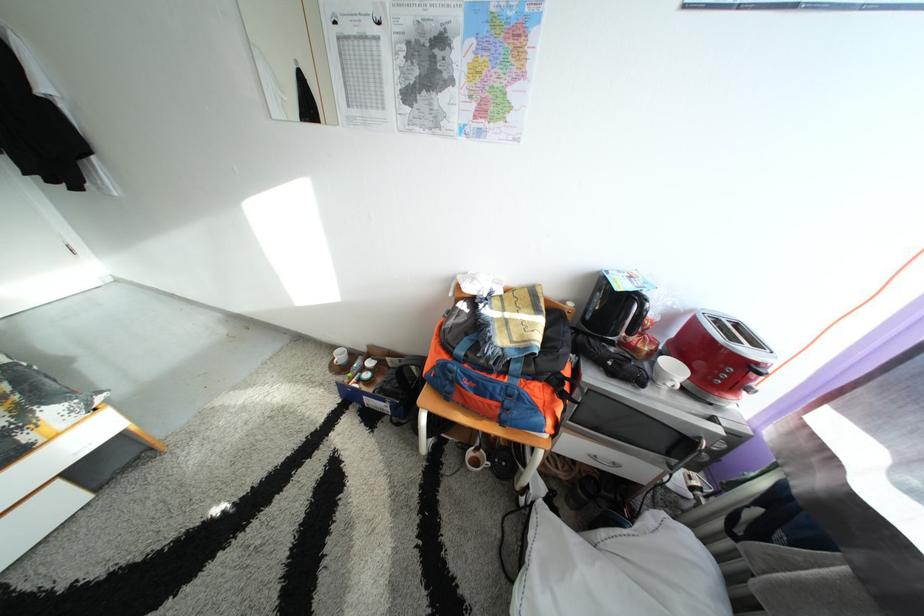
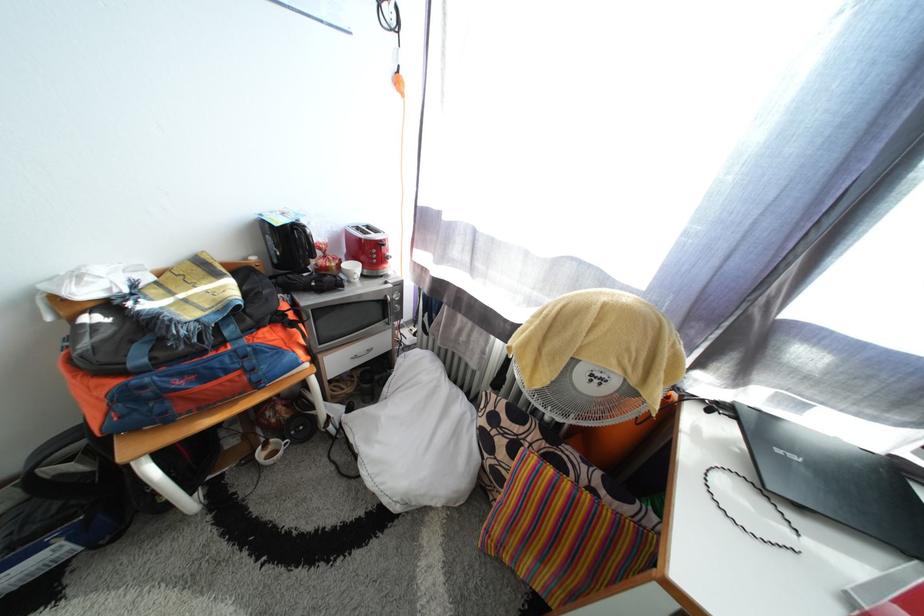
Where in the second image is the point corresponding to pixel 602 459 from the first image?

(361, 361)